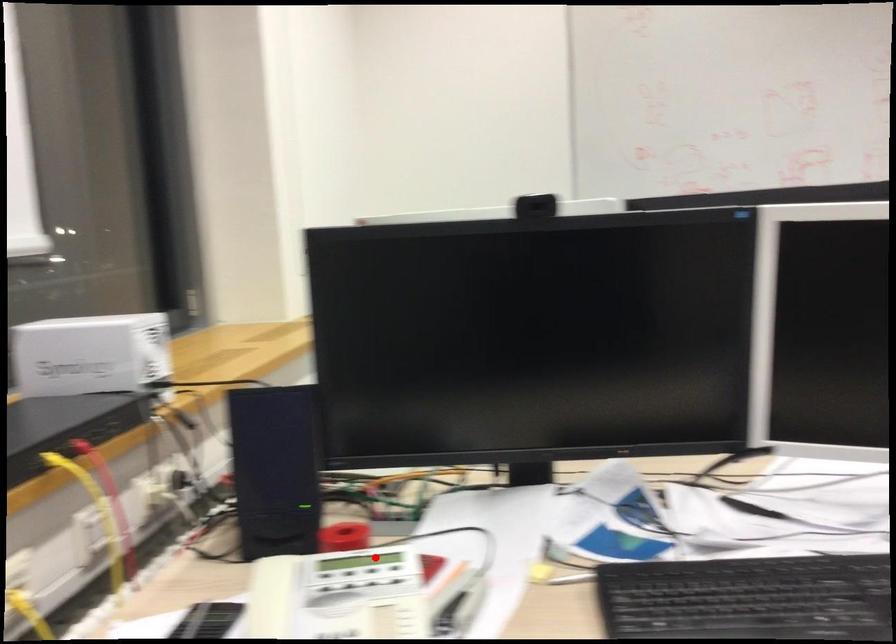
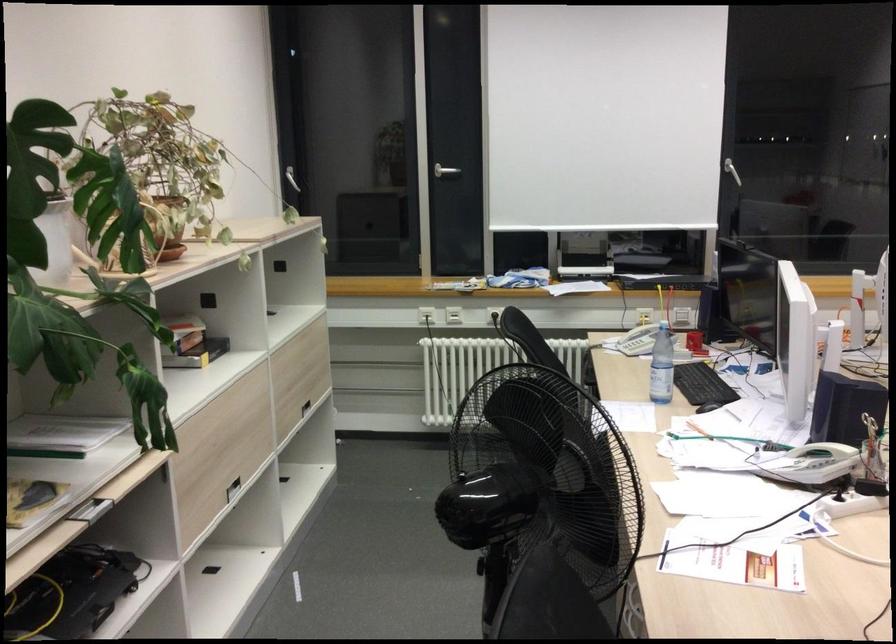
Find the pixel in the second image that matches the highlighted location in the first image.

(694, 343)